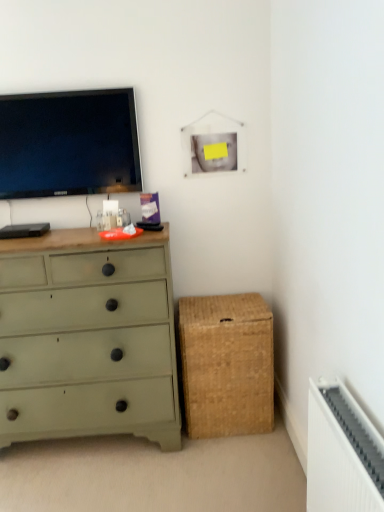
Question: In terms of height, does green painted wood chest of drawers at left look taller or shorter compared to braided wicker storage box at lower right?

Choices:
 (A) tall
 (B) short

Answer: (A)

Question: From a real-world perspective, relative to braided wicker storage box at lower right, is green painted wood chest of drawers at left vertically above or below?

Choices:
 (A) above
 (B) below

Answer: (A)

Question: Which is farther from the matte black tv at upper left?

Choices:
 (A) green painted wood chest of drawers at left
 (B) braided wicker storage box at lower right

Answer: (B)

Question: Which object is the farthest from the green painted wood chest of drawers at left?

Choices:
 (A) braided wicker storage box at lower right
 (B) matte black tv at upper left

Answer: (B)